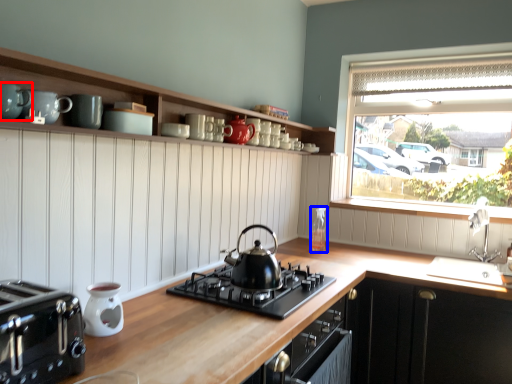
Question: Which object appears farthest to the camera in this image, teal (highlighted by a red box) or bottle (highlighted by a blue box)?

Choices:
 (A) teal
 (B) bottle

Answer: (B)